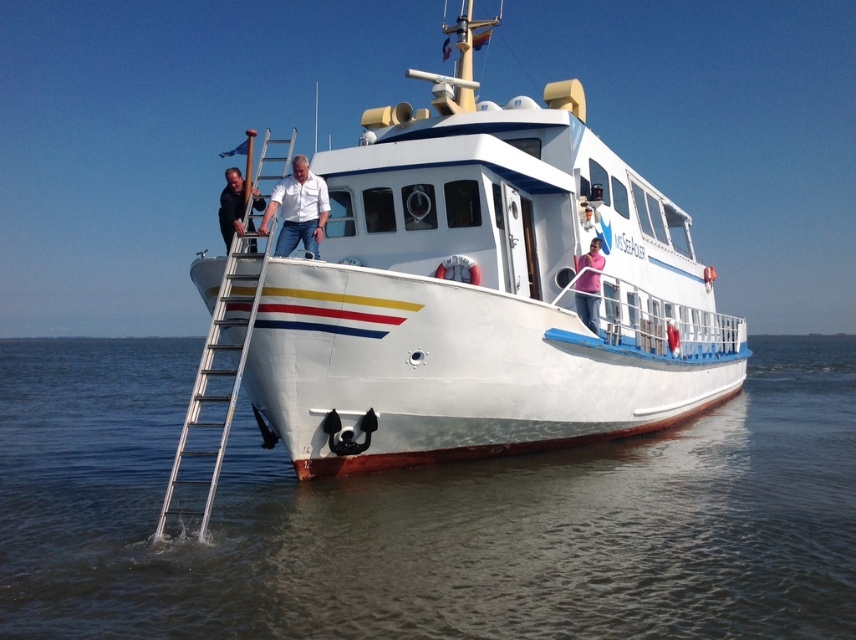
Image resolution: width=856 pixels, height=640 pixels. I want to click on white matte shirt at center, so click(298, 209).

Between point (292, 230) and point (223, 227), which one is positioned in front?

Point (223, 227)

Identify the location of white matte shirt at center. The width and height of the screenshot is (856, 640). (298, 209).

Which of these two, brown water at lower left or silver metallic ladder at left, stands taller?

With more height is silver metallic ladder at left.

Is the position of brown water at lower left less distant than that of silver metallic ladder at left?

Yes, brown water at lower left is in front of silver metallic ladder at left.

Is point (94, 400) more distant than point (218, 355)?

Yes, it is behind point (218, 355).

At what (x,y) coordinates should I click in order to perform the action: click on brown water at lower left. Please return your answer as a coordinate pair (x, y). Looking at the image, I should click on [x=426, y=516].

Locate an element on the screen. The image size is (856, 640). white glossy boat at center is located at coordinates (470, 292).